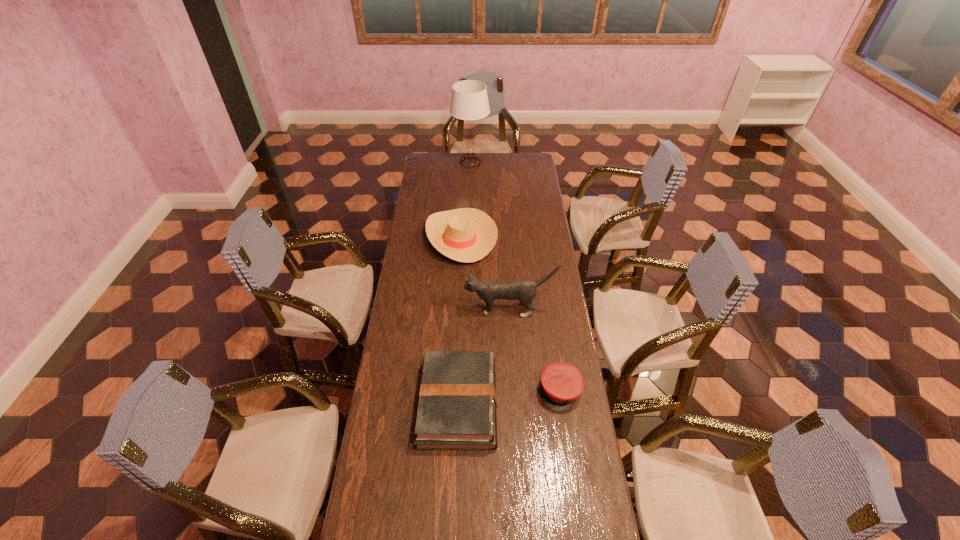
Locate an element on the screen. free region located 0.130m at the face of the third farthest object is located at coordinates (435, 309).

Where is `vacant space located on the right of the fourth nearest object`? vacant space located on the right of the fourth nearest object is located at coordinates (507, 237).

I want to click on free space located 0.060m on the spine side of the hardback book, so click(513, 403).

Locate an element on the screen. vacant space located 0.340m on the front of the cap with an emblem is located at coordinates (578, 515).

You are a GUI agent. You are given a task and a screenshot of the screen. Output one action in this format:
    pyautogui.click(x=<x>, y=<y>)
    Task: Click on the object that is at the far edge
    This screenshot has height=540, width=960.
    Given the screenshot: What is the action you would take?
    pyautogui.click(x=469, y=101)

Identify the location of sunhat present at the left edge. (467, 235).

Identify the location of hardback book present at the left edge. (457, 402).

Where is `cat at the right edge`? This screenshot has width=960, height=540. cat at the right edge is located at coordinates (525, 291).

Find the location of `cap that is at the right edge`. cap that is at the right edge is located at coordinates (561, 383).

Find the location of a particular element. The height and width of the screenshot is (540, 960). vacant space at the far edge of the desktop is located at coordinates (453, 161).